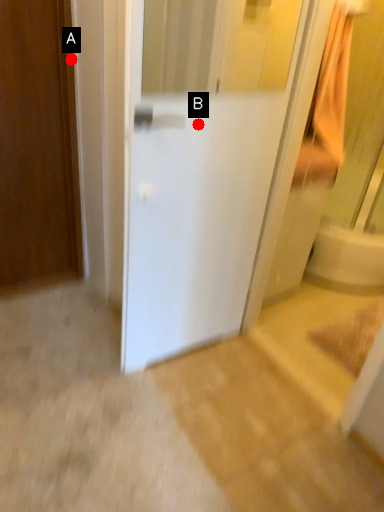
Question: Two points are circled on the image, labeled by A and B beside each circle. Which of the following is the closest to the observer?

Choices:
 (A) A is closer
 (B) B is closer

Answer: (B)